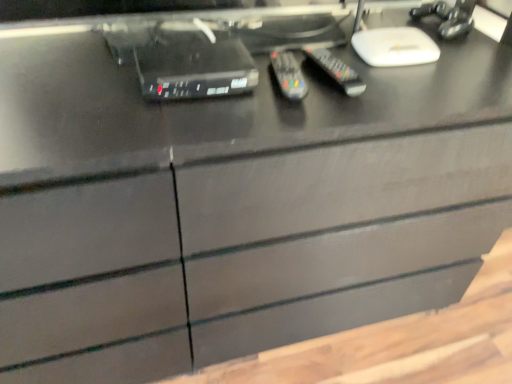
This screenshot has height=384, width=512. I want to click on empty space that is to the right of black plastic device at upper center, so click(x=295, y=108).